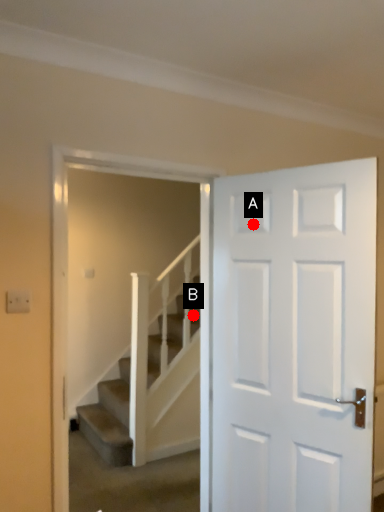
Question: Two points are circled on the image, labeled by A and B beside each circle. Which of the following is the farthest from the observer?

Choices:
 (A) A is further
 (B) B is further

Answer: (B)